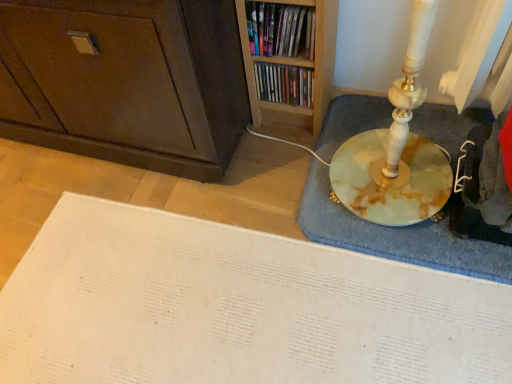
Question: Can you confirm if dark brown wood cabinet at lower left is smaller than matte plastic books at upper center, which appears as the second book when viewed from the front?

Choices:
 (A) yes
 (B) no

Answer: (B)

Question: Does dark brown wood cabinet at lower left have a lesser width compared to matte plastic books at upper center, which appears as the second book when viewed from the front?

Choices:
 (A) no
 (B) yes

Answer: (A)

Question: Is dark brown wood cabinet at lower left shorter than matte plastic books at upper center, which appears as the second book when viewed from the front?

Choices:
 (A) yes
 (B) no

Answer: (B)

Question: Does dark brown wood cabinet at lower left appear on the right side of matte plastic books at upper center, acting as the 1th book starting from the back?

Choices:
 (A) no
 (B) yes

Answer: (A)

Question: Is dark brown wood cabinet at lower left located outside matte plastic books at upper center, which appears as the second book when viewed from the front?

Choices:
 (A) yes
 (B) no

Answer: (A)

Question: Is dark brown wood cabinet at lower left at the left side of matte plastic books at upper center, which appears as the second book when viewed from the front?

Choices:
 (A) yes
 (B) no

Answer: (A)

Question: Is dark brown wood cabinet at lower left thinner than wooden bookshelf at upper center, the first book when ordered from front to back?

Choices:
 (A) no
 (B) yes

Answer: (A)

Question: Is wooden bookshelf at upper center, the first book when ordered from front to back, at the back of dark brown wood cabinet at lower left?

Choices:
 (A) yes
 (B) no

Answer: (B)

Question: Can you confirm if dark brown wood cabinet at lower left is wider than wooden bookshelf at upper center, arranged as the second book when viewed from the back?

Choices:
 (A) no
 (B) yes

Answer: (B)

Question: Is the position of dark brown wood cabinet at lower left more distant than that of wooden bookshelf at upper center, arranged as the second book when viewed from the back?

Choices:
 (A) no
 (B) yes

Answer: (A)

Question: Is dark brown wood cabinet at lower left next to wooden bookshelf at upper center, arranged as the second book when viewed from the back, and touching it?

Choices:
 (A) no
 (B) yes

Answer: (A)

Question: Does dark brown wood cabinet at lower left have a lesser height compared to wooden bookshelf at upper center, the first book when ordered from front to back?

Choices:
 (A) no
 (B) yes

Answer: (A)

Question: Is wooden bookshelf at upper center, the first book when ordered from front to back, facing towards matte plastic books at upper center, acting as the 1th book starting from the back?

Choices:
 (A) no
 (B) yes

Answer: (A)